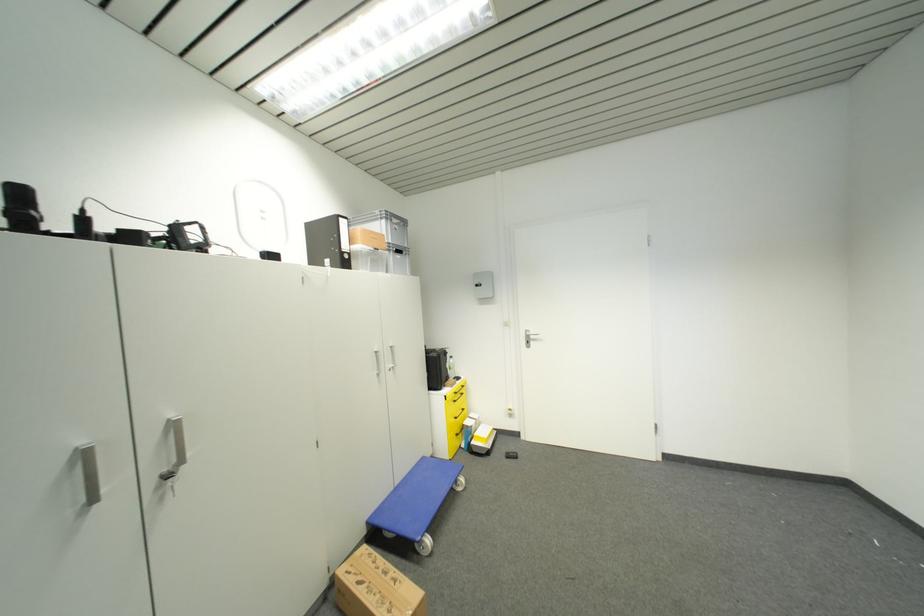
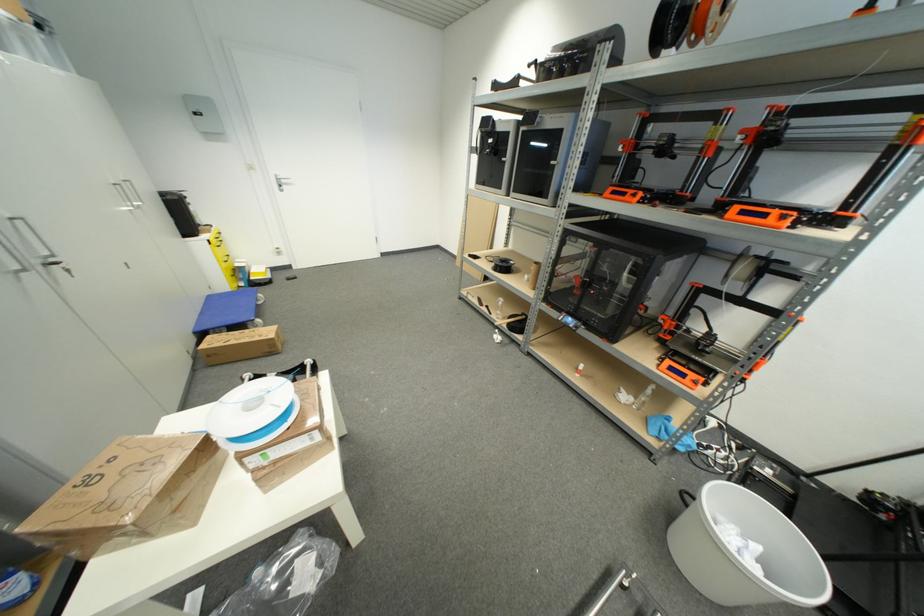
In the second image, find the point that corresponds to the point at 172,471 in the first image.

(43, 264)